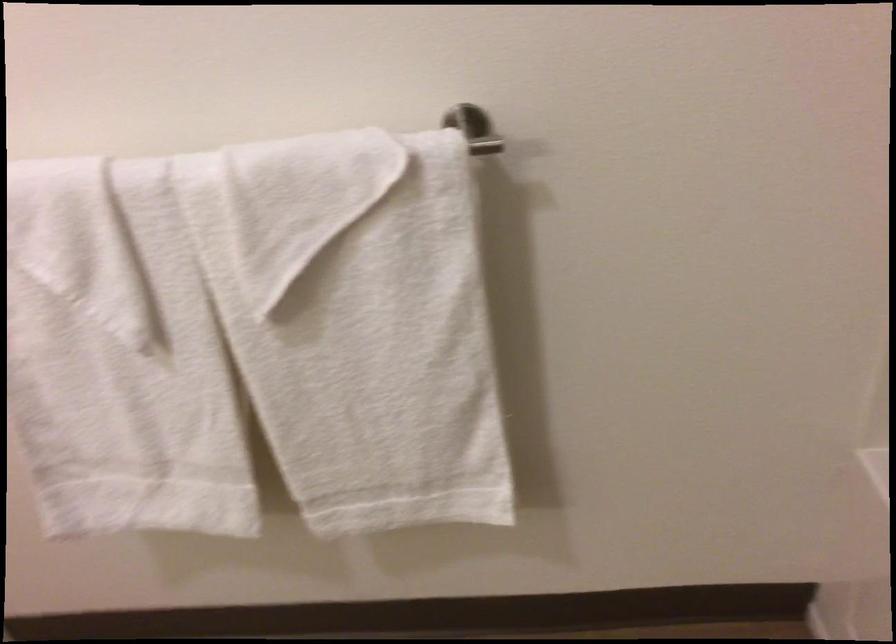
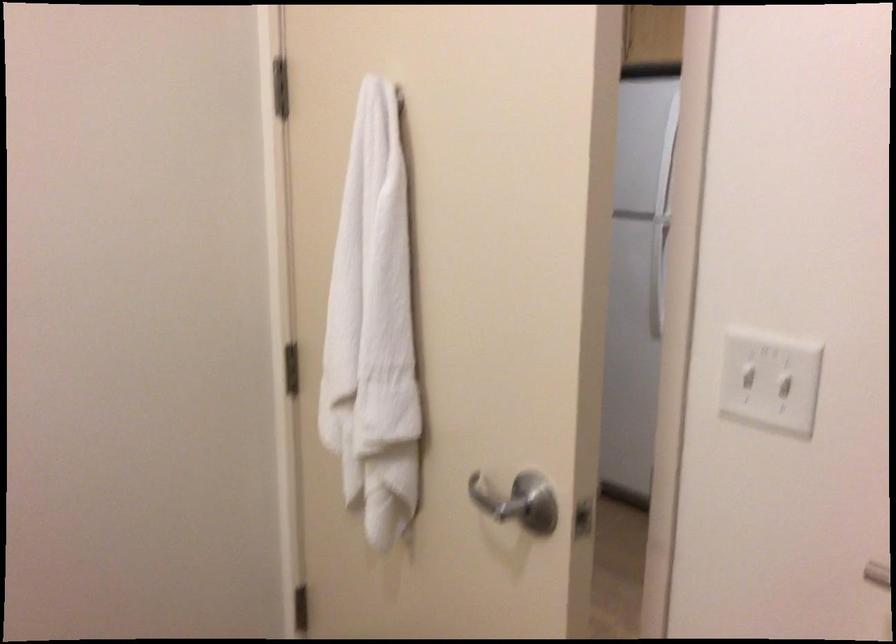
Question: The camera is either moving clockwise (left) or counter-clockwise (right) around the object. The first image is from the beginning of the video and the second image is from the end. Is the camera moving left or right when shooting the video?

Choices:
 (A) Left
 (B) Right

Answer: (B)